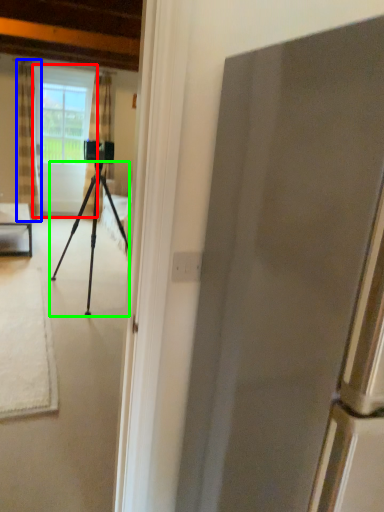
Question: Based on their relative distances, which object is nearer to screen door (highlighted by a red box)? Choose from curtain (highlighted by a blue box) and tripod (highlighted by a green box).

Choices:
 (A) curtain
 (B) tripod

Answer: (A)